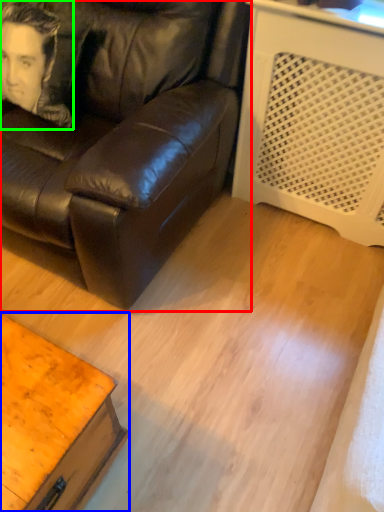
Question: Estimate the real-world distances between objects in this image. Which object is closer to studio couch (highlighted by a red box), table (highlighted by a blue box) or man (highlighted by a green box)?

Choices:
 (A) table
 (B) man

Answer: (B)